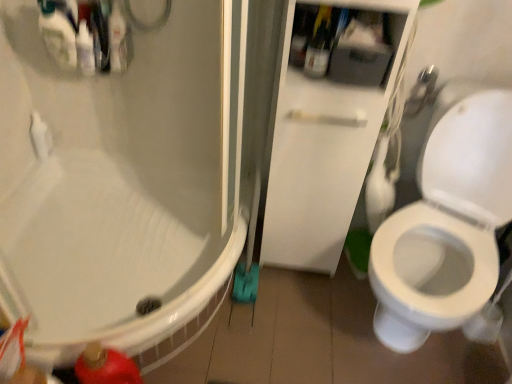
Question: In terms of width, does white glossy cabinet at center look wider or thinner when compared to translucent plastic bottles at upper left?

Choices:
 (A) wide
 (B) thin

Answer: (A)

Question: Looking at the image, does white glossy cabinet at center seem bigger or smaller compared to translucent plastic bottles at upper left?

Choices:
 (A) small
 (B) big

Answer: (B)

Question: Which object is positioned closest to the brushed metal showerhead at upper right?

Choices:
 (A) translucent plastic bottle at upper center
 (B) white glossy cabinet at center
 (C) translucent plastic bottles at upper left
 (D) white glossy bathtub at lower left

Answer: (A)

Question: Estimate the real-world distances between objects in this image. Which object is closer to the translucent plastic bottle at upper center?

Choices:
 (A) translucent plastic bottles at upper left
 (B) brushed metal showerhead at upper right
 (C) white glossy cabinet at center
 (D) white glossy bathtub at lower left

Answer: (C)